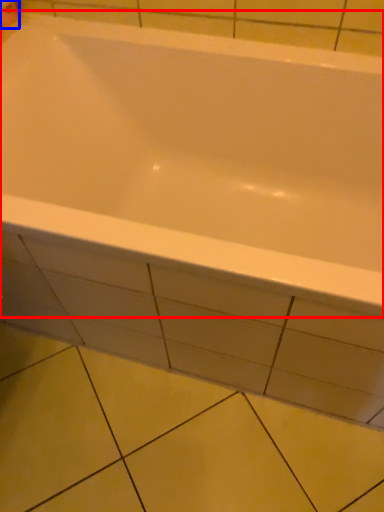
Question: Which point is closer to the camera, bathtub (highlighted by a red box) or toilet paper (highlighted by a blue box)?

Choices:
 (A) bathtub
 (B) toilet paper

Answer: (A)